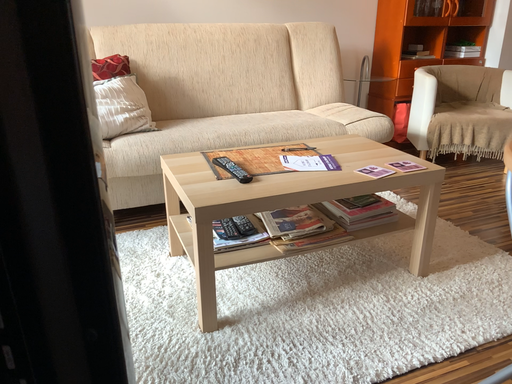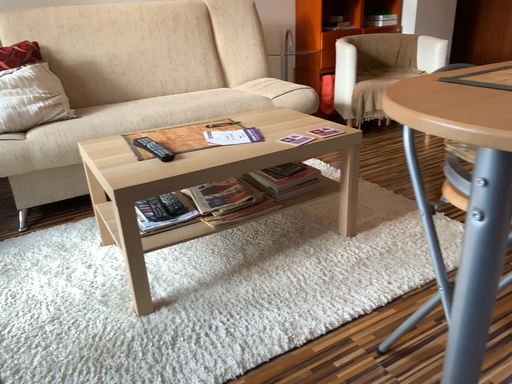
Question: Which way did the camera rotate in the video?

Choices:
 (A) rotated right
 (B) rotated left

Answer: (A)